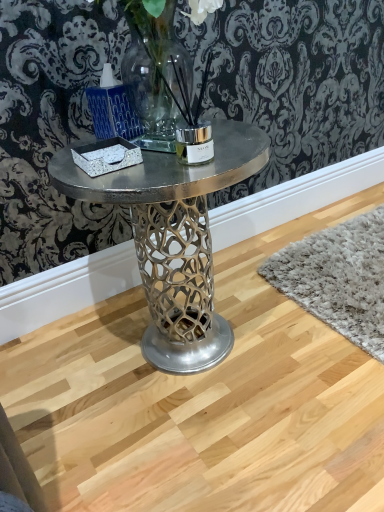
Question: Is matte blue candle holder at upper left far from metallic silver table at center?

Choices:
 (A) yes
 (B) no

Answer: (B)

Question: Is matte blue candle holder at upper left facing towards metallic silver table at center?

Choices:
 (A) no
 (B) yes

Answer: (A)

Question: From the image's perspective, does matte blue candle holder at upper left appear higher than metallic silver table at center?

Choices:
 (A) no
 (B) yes

Answer: (B)

Question: From a real-world perspective, is matte blue candle holder at upper left physically above metallic silver table at center?

Choices:
 (A) no
 (B) yes

Answer: (B)

Question: Is matte blue candle holder at upper left surrounding metallic silver table at center?

Choices:
 (A) no
 (B) yes

Answer: (A)

Question: Considering the relative sizes of matte blue candle holder at upper left and metallic silver table at center in the image provided, is matte blue candle holder at upper left smaller than metallic silver table at center?

Choices:
 (A) no
 (B) yes

Answer: (B)

Question: Is matte blue candle holder at upper left inside metallic silver table at center?

Choices:
 (A) no
 (B) yes

Answer: (A)

Question: Considering the relative sizes of metallic silver table at center and matte blue candle holder at upper left in the image provided, is metallic silver table at center bigger than matte blue candle holder at upper left?

Choices:
 (A) yes
 (B) no

Answer: (A)

Question: Can you confirm if metallic silver table at center is positioned to the left of matte blue candle holder at upper left?

Choices:
 (A) no
 (B) yes

Answer: (A)

Question: From the image's perspective, is metallic silver table at center on top of matte blue candle holder at upper left?

Choices:
 (A) no
 (B) yes

Answer: (A)

Question: From a real-world perspective, is metallic silver table at center located higher than matte blue candle holder at upper left?

Choices:
 (A) no
 (B) yes

Answer: (A)

Question: Is metallic silver table at center wider than matte blue candle holder at upper left?

Choices:
 (A) yes
 (B) no

Answer: (B)

Question: From the image's perspective, is metallic silver table at center above or below matte blue candle holder at upper left?

Choices:
 (A) above
 (B) below

Answer: (B)